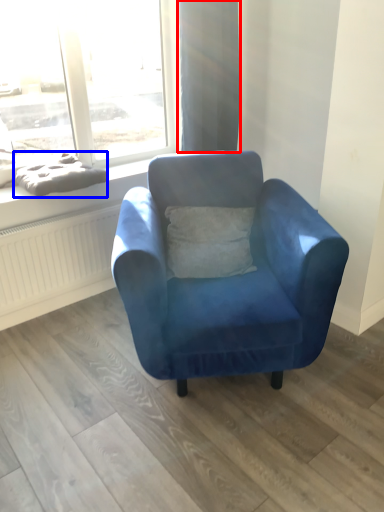
Question: Which of the following is the farthest to the observer, curtain (highlighted by a red box) or material (highlighted by a blue box)?

Choices:
 (A) curtain
 (B) material

Answer: (A)